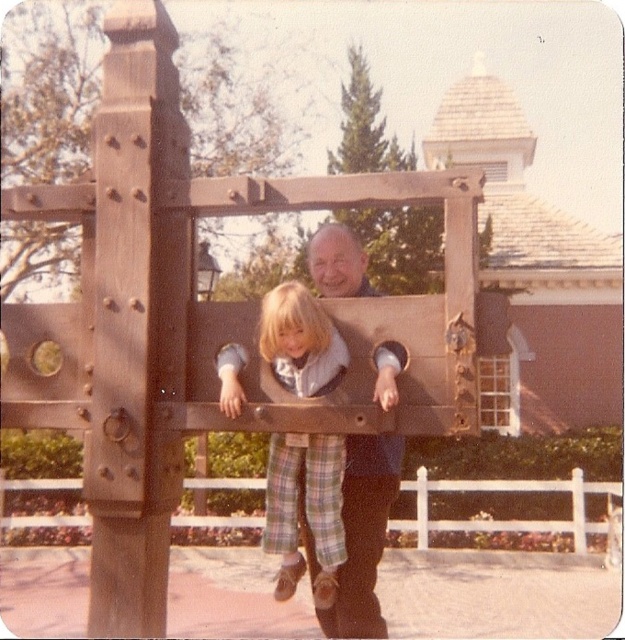
Is point (301, 316) positioned after point (390, 474)?

No, (301, 316) is closer to viewer.

The width and height of the screenshot is (625, 640). What do you see at coordinates (306, 509) in the screenshot?
I see `plaid pants at center` at bounding box center [306, 509].

Is point (288, 349) less distant than point (361, 483)?

That is True.

The image size is (625, 640). Find the location of `plaid pants at center`. plaid pants at center is located at coordinates (306, 509).